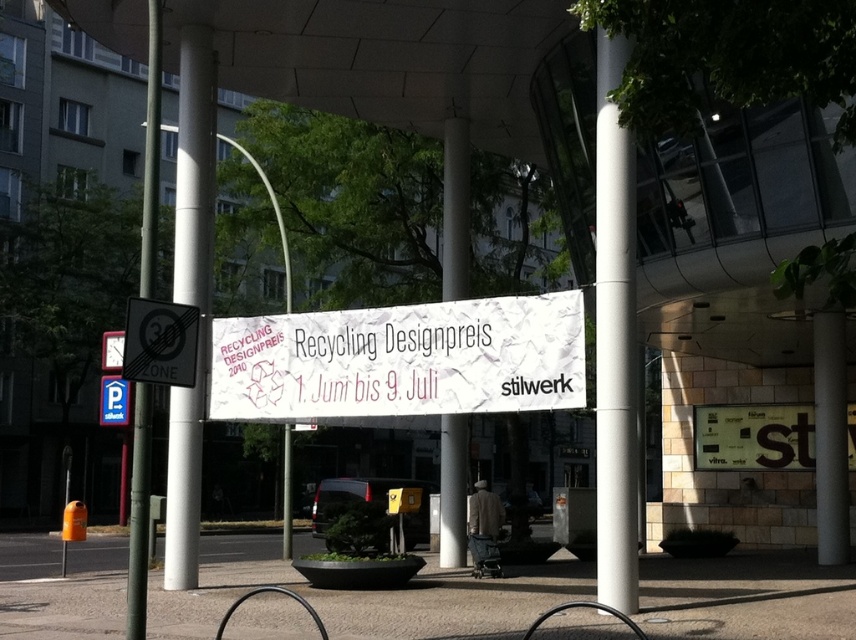
You are standing at the entrance of the architectural structure and see two points marked on the banner. The first point is at coordinates point(x=613, y=132) and the second is at point(x=152, y=16). From your position, which point is closer to you?

Point(x=152, y=16) is closer to you because it is in front of point(x=613, y=132).

What is the relationship between the width of the black reflective zone sign at left and the metallic pole at center?

The black reflective zone sign at left is narrower than the metallic pole at center because its width is less than that of the metallic pole at center.

You are a pedestrian standing at the entrance of the walkway. You see the black reflective zone sign at left and the metallic pole at center. Which object is nearer to you?

The black reflective zone sign at left is closer to the viewer than the metallic pole at center.